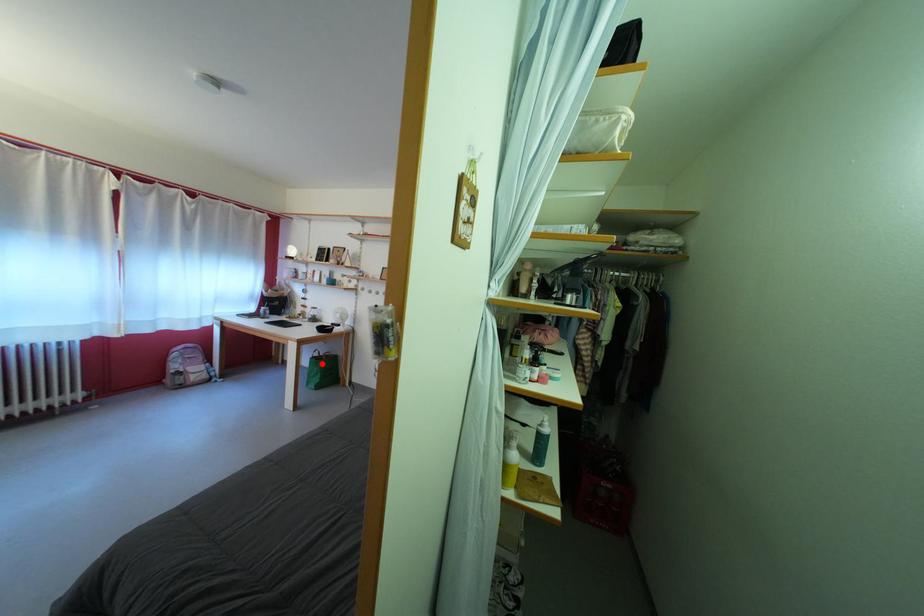
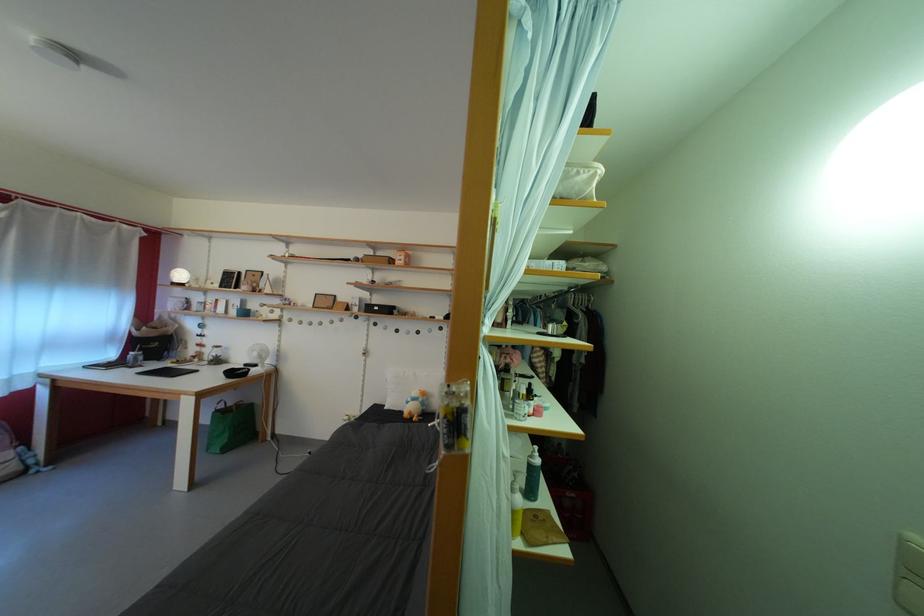
Question: A red point is marked in image1. In image2, is the corresponding 3D point closer to the camera or farther? Reply with the corresponding letter.

Choices:
 (A) The corresponding 3D point is closer.
 (B) The corresponding 3D point is farther.

Answer: (A)